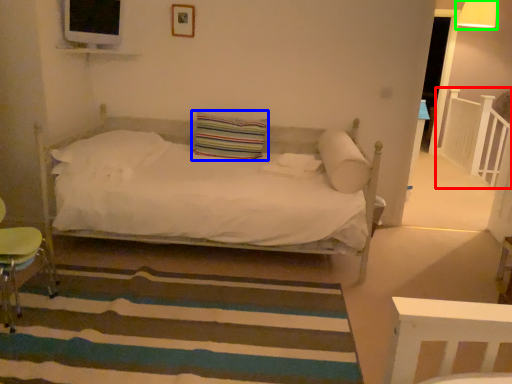
Question: Based on their relative distances, which object is farther from balustrade (highlighted by a red box)? Choose from pillow (highlighted by a blue box) and lamp (highlighted by a green box).

Choices:
 (A) pillow
 (B) lamp

Answer: (A)